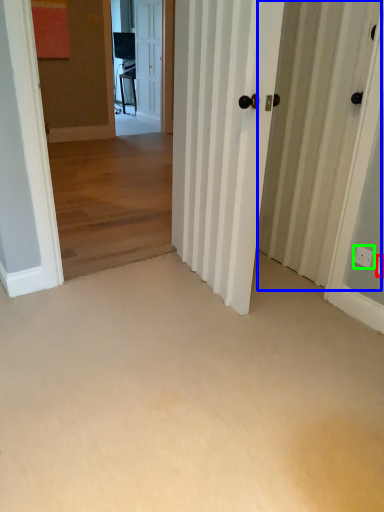
Question: Which object is the closest to the electric outlet (highlighted by a red box)? Choose among these: barn door (highlighted by a blue box) or electric outlet (highlighted by a green box).

Choices:
 (A) barn door
 (B) electric outlet

Answer: (B)